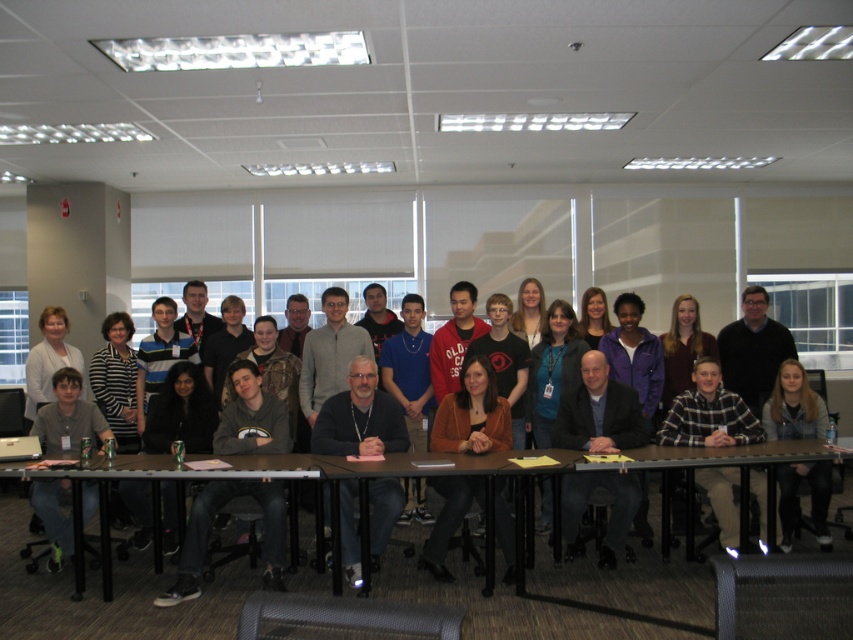
You are sitting at the wooden table at lower center and want to hand a document to the person wearing the matte gray shirt at lower left. In which direction should you pass the document?

The wooden table at lower center is to the right of matte gray shirt at lower left, so you should pass the document to the left to reach the person wearing the matte gray shirt at lower left.